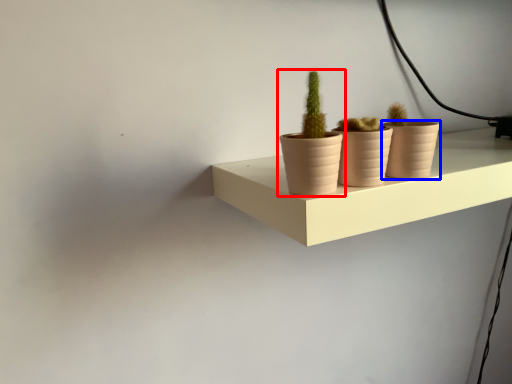
Question: Which object is closer to the camera taking this photo, houseplant (highlighted by a red box) or flowerpot (highlighted by a blue box)?

Choices:
 (A) houseplant
 (B) flowerpot

Answer: (A)